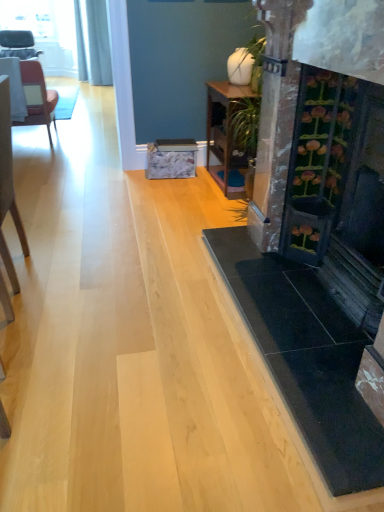
The width and height of the screenshot is (384, 512). I want to click on vacant area that is situated to the right of light brown wooden chair at left, which is the 3th chair in left-to-right order, so click(87, 266).